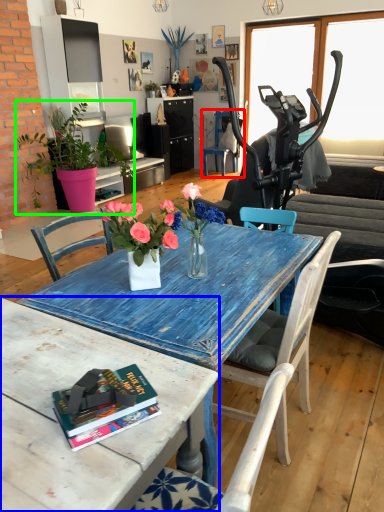
Question: Which is farther away from chair (highlighted by a red box)? table (highlighted by a blue box) or houseplant (highlighted by a green box)?

Choices:
 (A) table
 (B) houseplant

Answer: (A)